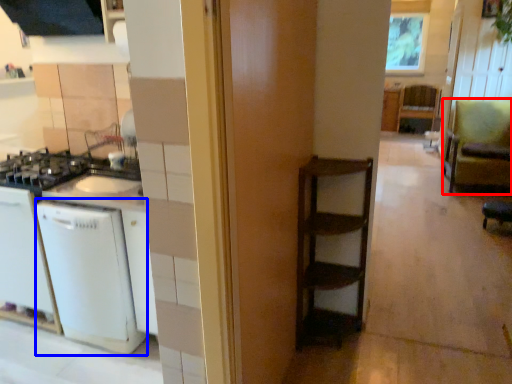
Question: Which object is closer to the camera taking this photo, armchair (highlighted by a red box) or dish washer (highlighted by a blue box)?

Choices:
 (A) armchair
 (B) dish washer

Answer: (B)